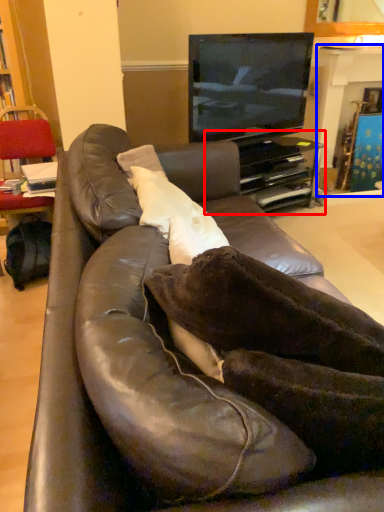
Question: Which object is closer to the camera taking this photo, entertainment center (highlighted by a red box) or fireplace (highlighted by a blue box)?

Choices:
 (A) entertainment center
 (B) fireplace

Answer: (A)